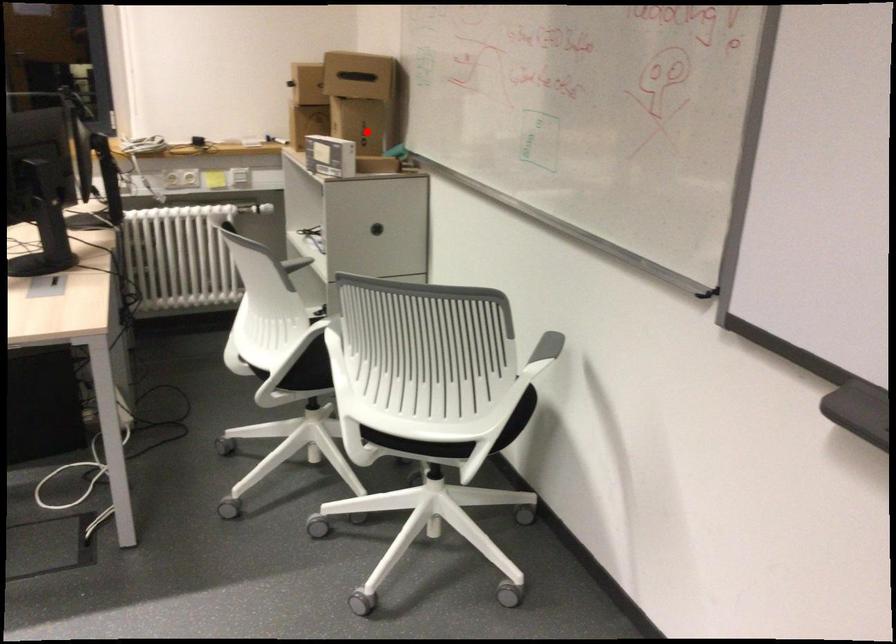
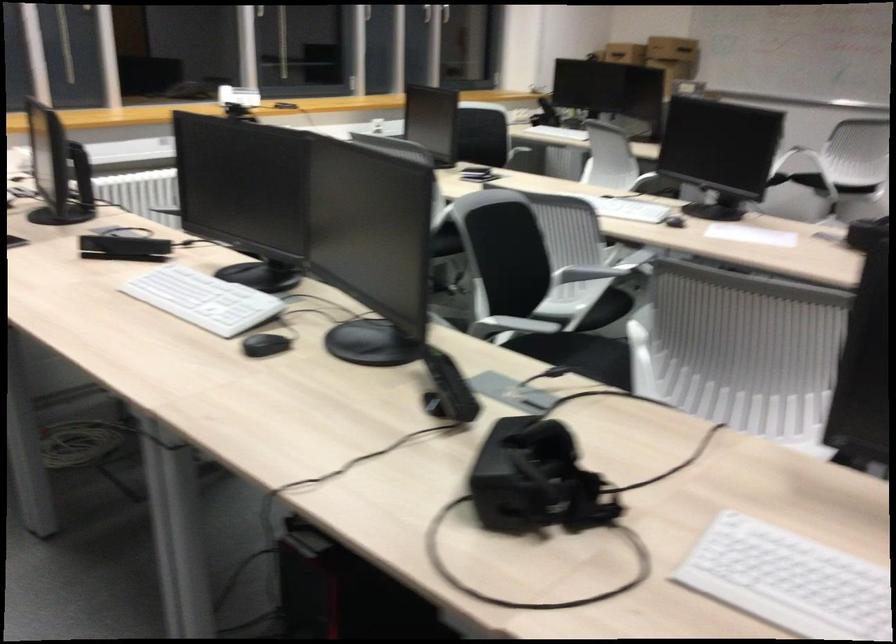
Question: I am providing you with two images of the same scene from different viewpoints. A red point is marked on the first image. Can you still see the location of the red point in image 2?

Choices:
 (A) Yes
 (B) No

Answer: (B)